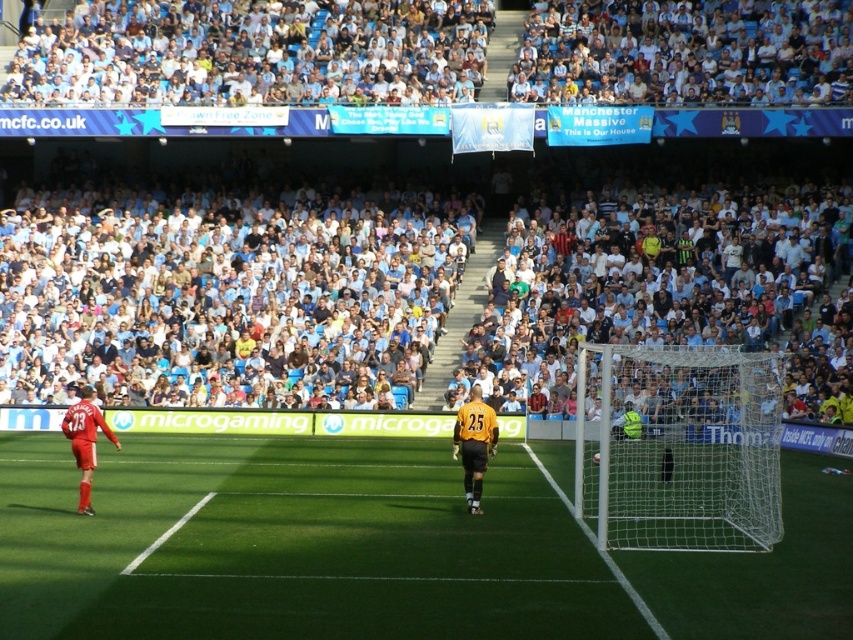
Who is more forward, (775, 35) or (79, 490)?

Positioned in front is point (79, 490).

Can you confirm if white fabric crowd at upper center is positioned above red jersey at left?

Yes.

The width and height of the screenshot is (853, 640). Describe the element at coordinates (247, 51) in the screenshot. I see `white fabric crowd at upper center` at that location.

Find the location of a particular element. The height and width of the screenshot is (640, 853). white fabric crowd at upper center is located at coordinates (247, 51).

Does white fabric crowd at upper center appear over white mesh net at right?

Indeed, white fabric crowd at upper center is positioned over white mesh net at right.

Does white fabric crowd at upper center appear on the left side of white mesh net at right?

Yes, white fabric crowd at upper center is to the left of white mesh net at right.

At what (x,y) coordinates should I click in order to perform the action: click on white fabric crowd at upper center. Please return your answer as a coordinate pair (x, y). This screenshot has width=853, height=640. Looking at the image, I should click on (247, 51).

Locate an element on the screen. The width and height of the screenshot is (853, 640). white fabric crowd at upper center is located at coordinates (247, 51).

Consider the image. Is yellow jersey at center positioned at the back of red jersey at left?

Yes, it is behind red jersey at left.

Does point (485, 403) lie behind point (91, 403)?

That is True.

Which is behind, point (479, 401) or point (103, 420)?

Positioned behind is point (103, 420).

This screenshot has width=853, height=640. Identify the location of yellow jersey at center. (474, 444).